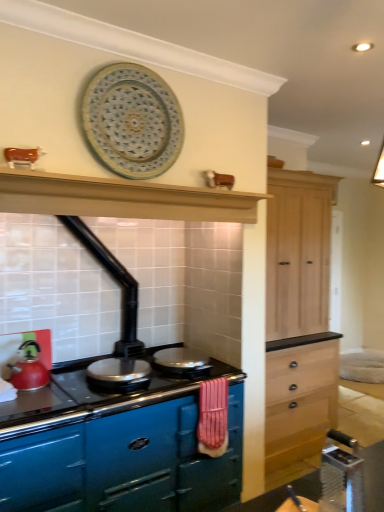
You are a GUI agent. You are given a task and a screenshot of the screen. Output one action in this format:
    pyautogui.click(x=<x>, y=<y>)
    Task: Click on the free point above glossy enamel stove at center (from a real-world perspective)
    
    Given the screenshot: What is the action you would take?
    pyautogui.click(x=98, y=385)